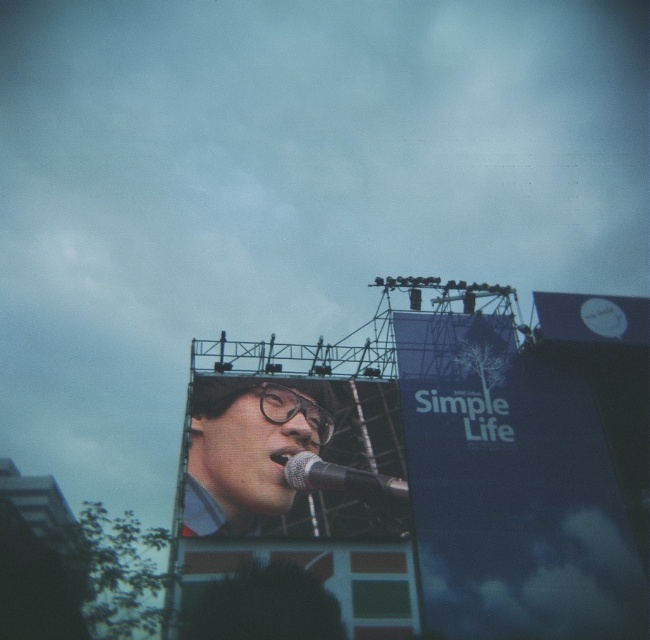
Question: Based on their relative distances, which object is nearer to the matte black microphone at center?

Choices:
 (A) green fabric banner at lower center
 (B) silver metallic microphone at center
 (C) blue matte signboard at upper right

Answer: (B)

Question: Is blue matte signboard at upper right to the right of green fabric banner at lower center from the viewer's perspective?

Choices:
 (A) yes
 (B) no

Answer: (A)

Question: Does green fabric banner at lower center appear on the right side of silver metallic microphone at center?

Choices:
 (A) no
 (B) yes

Answer: (A)

Question: Is blue matte signboard at upper right to the left of green fabric banner at lower center from the viewer's perspective?

Choices:
 (A) yes
 (B) no

Answer: (B)

Question: Which point is closer to the camera?

Choices:
 (A) (411, 445)
 (B) (339, 467)

Answer: (B)

Question: Which point appears closest to the camera in this image?

Choices:
 (A) (283, 461)
 (B) (391, 490)

Answer: (A)